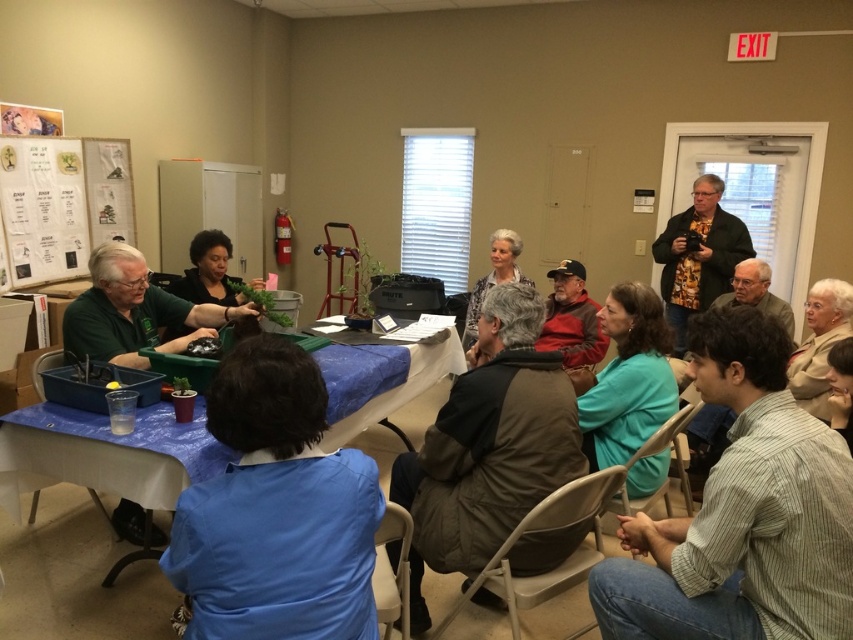
Question: Among these points, which one is nearest to the camera?

Choices:
 (A) (518, 237)
 (B) (813, 284)
 (C) (622, 310)
 (D) (184, 294)

Answer: (C)

Question: Among these objects, which one is farthest from the camera?

Choices:
 (A) striped cotton shirt at lower right
 (B) red fleece jacket at center
 (C) brown fuzzy vest at center

Answer: (B)

Question: Is striped cotton shirt at lower right bigger than blue fabric table at lower left?

Choices:
 (A) no
 (B) yes

Answer: (A)

Question: Is green matte shirt at center positioned in front of red fleece jacket at center?

Choices:
 (A) no
 (B) yes

Answer: (B)

Question: Can you confirm if blue fabric at lower center is thinner than blue fabric table at lower left?

Choices:
 (A) yes
 (B) no

Answer: (A)

Question: Which of the following is the closest to the observer?

Choices:
 (A) (300, 628)
 (B) (624, 300)
 (C) (737, 257)

Answer: (A)